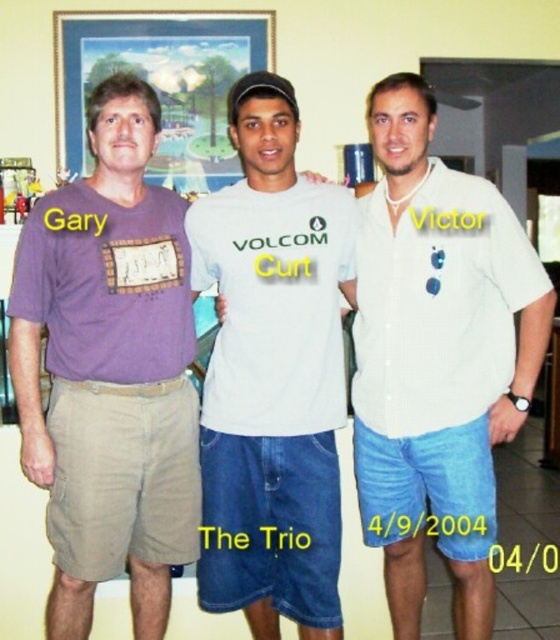
Where is the white textured shirt at center located?

The white textured shirt at center is located at point (438, 304).